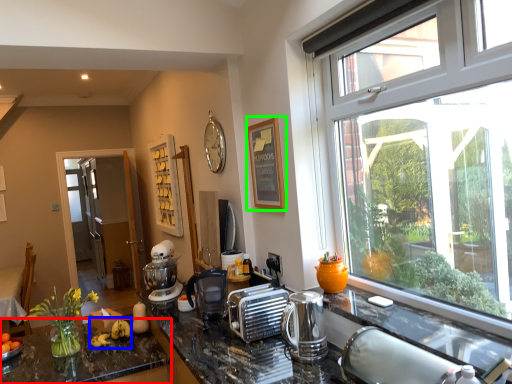
Question: Estimate the real-world distances between objects in this image. Which object is closer to countertop (highlighted by a red box), banana (highlighted by a blue box) or picture frame (highlighted by a green box)?

Choices:
 (A) banana
 (B) picture frame

Answer: (A)